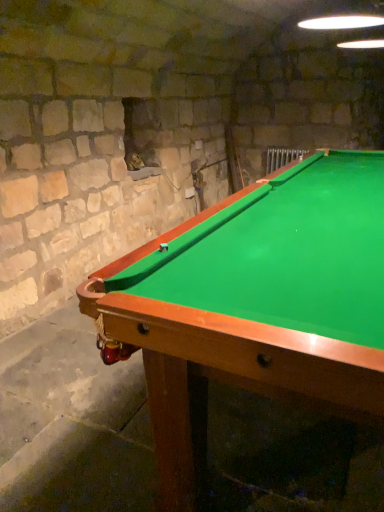
Question: Should I look upward or downward to see green felt pool table at center?

Choices:
 (A) down
 (B) up

Answer: (A)